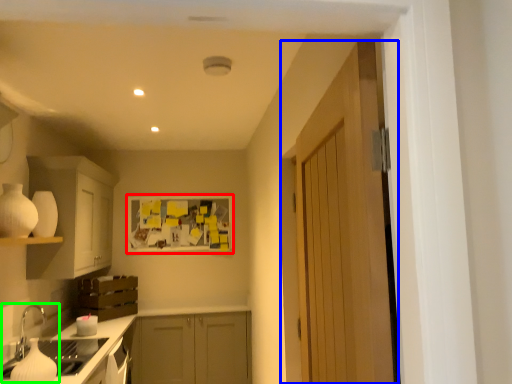
Question: Which is nearer to the bulletin board (highlighted by a red box)? door (highlighted by a blue box) or sink (highlighted by a green box).

Choices:
 (A) door
 (B) sink

Answer: (B)